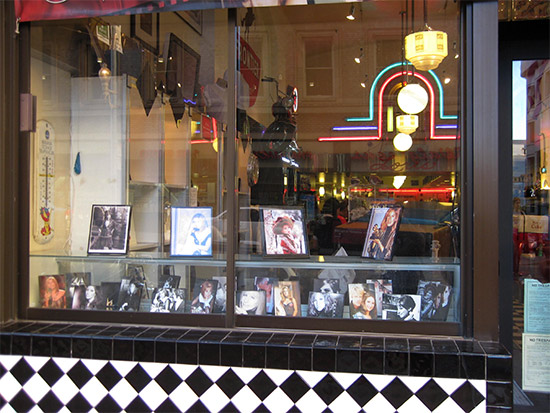
I want to click on purple neon light, so (x=359, y=128).